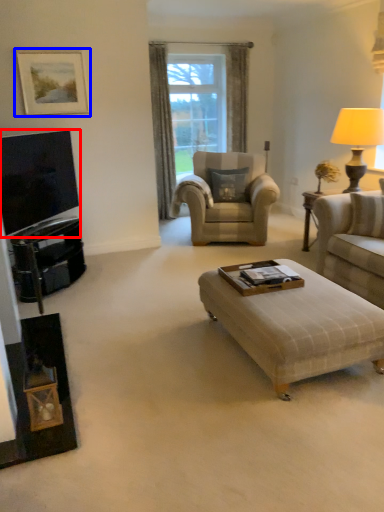
Question: Which point is closer to the camera, television (highlighted by a red box) or picture frame (highlighted by a blue box)?

Choices:
 (A) television
 (B) picture frame

Answer: (A)